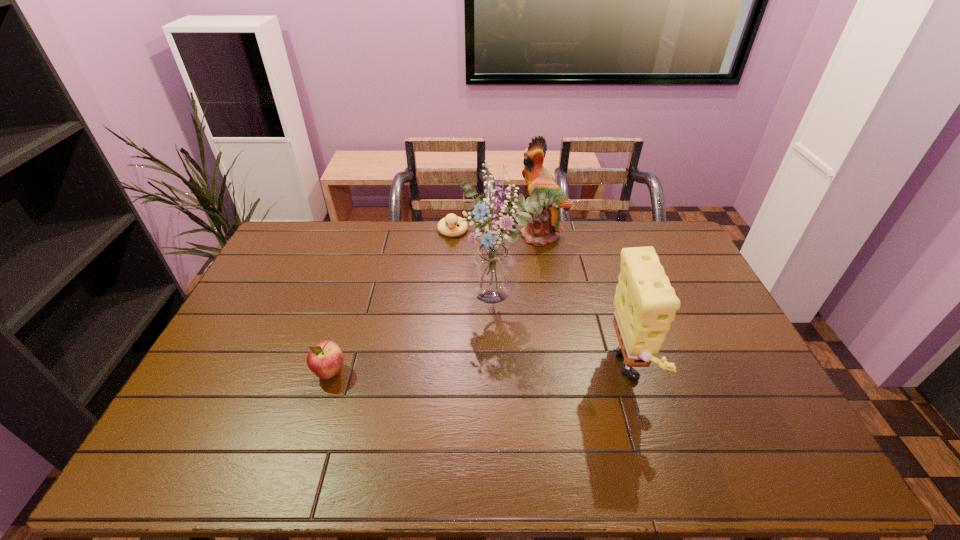
This screenshot has height=540, width=960. I want to click on free space on the desktop that is between the apple and the sponge and is positioned on the front-facing side of the third nearest object, so click(x=469, y=373).

You are a GUI agent. You are given a task and a screenshot of the screen. Output one action in this format:
    pyautogui.click(x=<x>, y=<y>)
    Task: Click on the free space on the desktop that is between the leftmost object and the sponge and is positioned on the front-facing side of the second tallest object
    The image size is (960, 540).
    Given the screenshot: What is the action you would take?
    pyautogui.click(x=455, y=373)

At what (x,y) coordinates should I click in order to perform the action: click on vacant space on the desktop that is between the apple and the sponge and is positioned at the beak of the duckling. Please return your answer as a coordinate pair (x, y). The image size is (960, 540). Looking at the image, I should click on (437, 373).